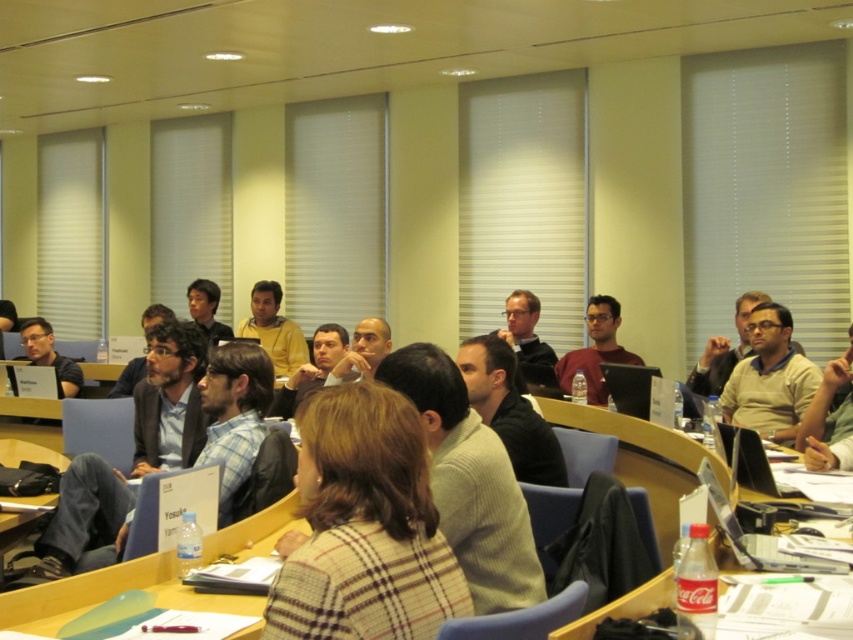
You are sitting in the conference room and want to hand a document to the person wearing the light brown shirt at center and the matte beige sweater at center. Since you can only reach forward, which one can you reach first?

The light brown shirt at center is located below the matte beige sweater at center, so you can reach the light brown shirt at center first by extending your arm forward.

You are standing at the entrance of the conference room and see the point marked at coordinates (769, 378). What object is located at that point?

The point at coordinates (769, 378) corresponds to the matte beige sweater at center.